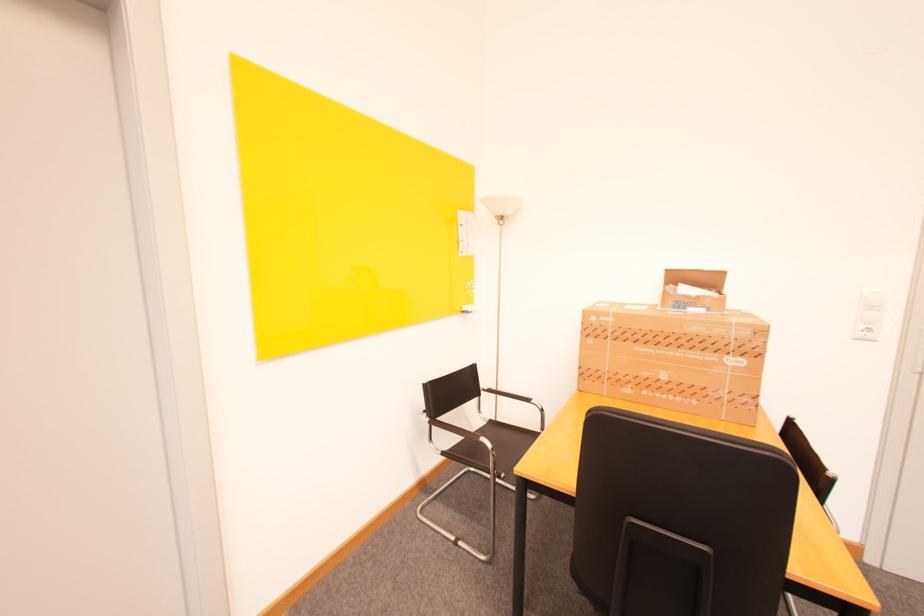
Locate an element on the screen. small cardboard box is located at coordinates (694, 289).